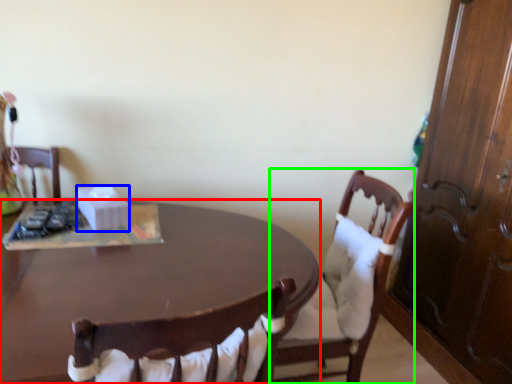
Question: Which object is the farthest from desk (highlighted by a red box)? Choose among these: box (highlighted by a blue box) or chair (highlighted by a green box).

Choices:
 (A) box
 (B) chair

Answer: (B)